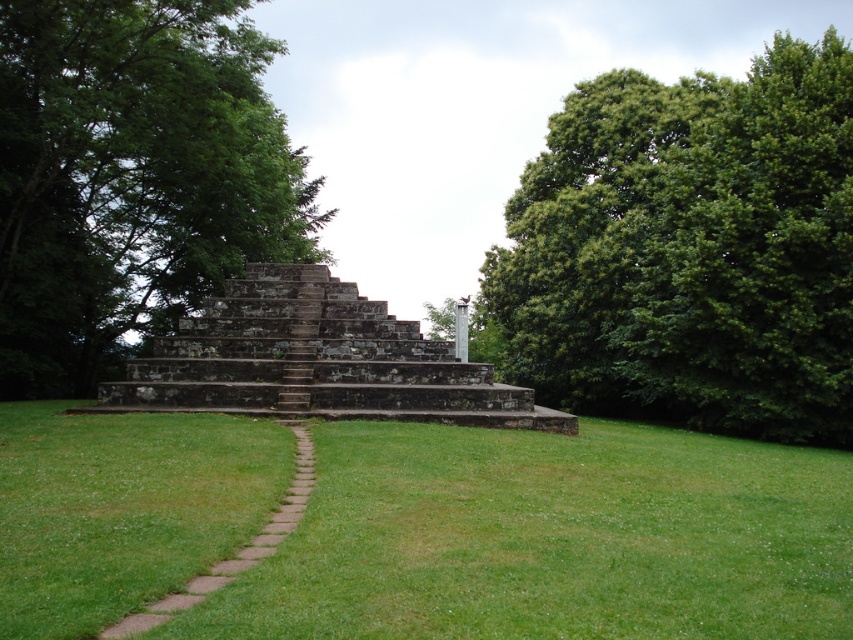
You are standing at the base of the stone structure and want to walk towards the column on top. There are two points marked on the ground as you look forward. Which point, point 1 at coordinates point (149,248) or point 2 at coordinates point (163,621), is closer to you?

Point 1 at coordinates point (149,248) is closer to you because it is further to the camera than point 2 at coordinates point (163,621), meaning it is nearer in your line of sight.

You are standing at the base of the stone structure and want to walk towards the green grass at center. Which direction should you head?

The green grass at center is located at point coordinates, so you should head towards the center of the image.